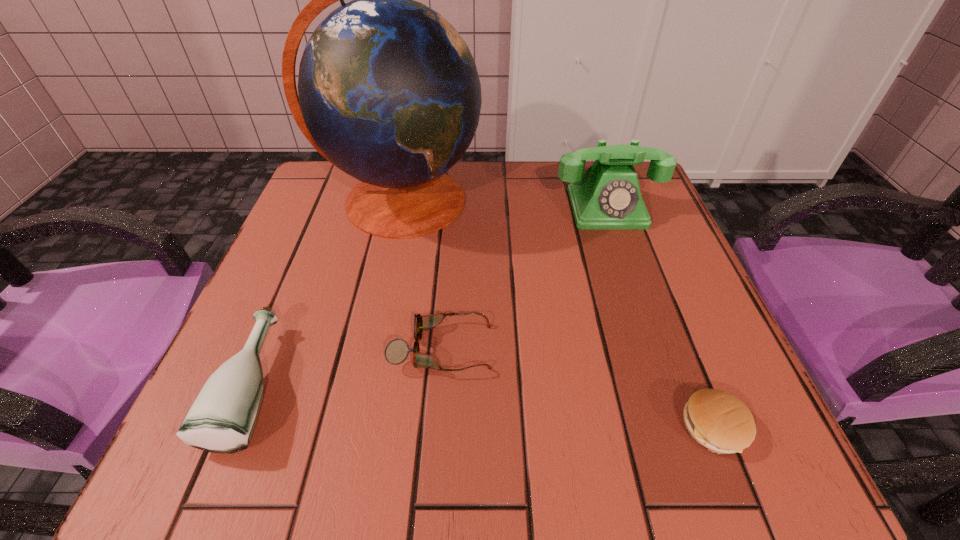
Where is `the tallest object`? the tallest object is located at coordinates (389, 93).

I want to click on the second tallest object, so click(x=607, y=196).

Where is `bottle`? The image size is (960, 540). bottle is located at coordinates (222, 418).

Image resolution: width=960 pixels, height=540 pixels. Identify the location of spectacles. tap(396, 352).

Locate an element on the screen. The image size is (960, 540). patty is located at coordinates (717, 420).

In order to click on free space located 0.270m with the Americas facing the viewer on the tallest object in this screenshot , I will do [x=365, y=362].

At what (x,y) coordinates should I click in order to perform the action: click on blank area located on the dial of the fourth shortest object. Please return your answer as a coordinate pair (x, y). Looking at the image, I should click on click(x=623, y=255).

Locate an element on the screen. The image size is (960, 540). vacant space located on the back of the third shortest object is located at coordinates (332, 197).

Locate an element on the screen. Image resolution: width=960 pixels, height=540 pixels. vacant space situated on the front-facing side of the spectacles is located at coordinates (552, 348).

Locate an element on the screen. The height and width of the screenshot is (540, 960). vacant space situated 0.320m on the left of the patty is located at coordinates (459, 427).